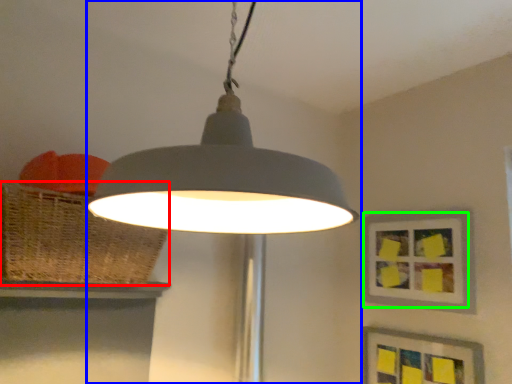
Question: Which is nearer to the basket (highlighted by a red box)? lamp (highlighted by a blue box) or picture frame (highlighted by a green box).

Choices:
 (A) lamp
 (B) picture frame

Answer: (A)